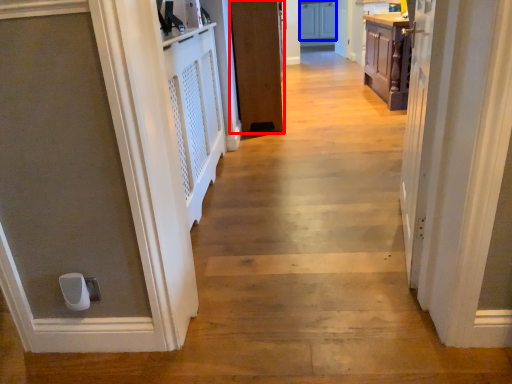
Question: Which of the following is the closest to the observer, door (highlighted by a red box) or cabinetry (highlighted by a blue box)?

Choices:
 (A) door
 (B) cabinetry

Answer: (A)